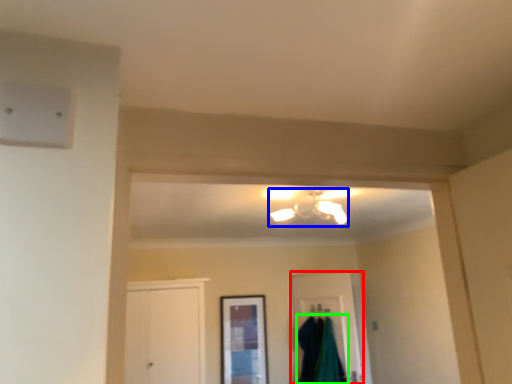
Question: Estimate the real-world distances between objects in this image. Which object is farther from door (highlighted by a red box), light fixture (highlighted by a blue box) or robe (highlighted by a green box)?

Choices:
 (A) light fixture
 (B) robe

Answer: (A)